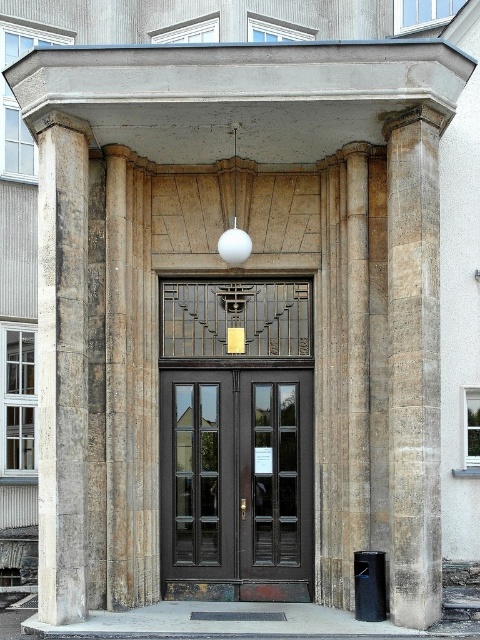
Question: Considering the relative positions of stone textured column at right and stone column at center in the image provided, where is stone textured column at right located with respect to stone column at center?

Choices:
 (A) left
 (B) right

Answer: (B)

Question: Considering the real-world distances, which object is closest to the matte black door at center?

Choices:
 (A) dark brown wood door at center
 (B) white matte sphere at center

Answer: (A)

Question: Based on their relative distances, which object is nearer to the light beige stone column at left?

Choices:
 (A) dark brown wood door at center
 (B) stone textured column at right

Answer: (A)

Question: Is dark brown wood door at center above dark wood door at center?

Choices:
 (A) yes
 (B) no

Answer: (A)

Question: Can you confirm if light beige stone column at left is smaller than stone column at center?

Choices:
 (A) yes
 (B) no

Answer: (B)

Question: Which point is farther to the camera?

Choices:
 (A) matte black door at center
 (B) dark brown wood door at center
 (C) stone column at center
 (D) white matte sphere at center

Answer: (B)